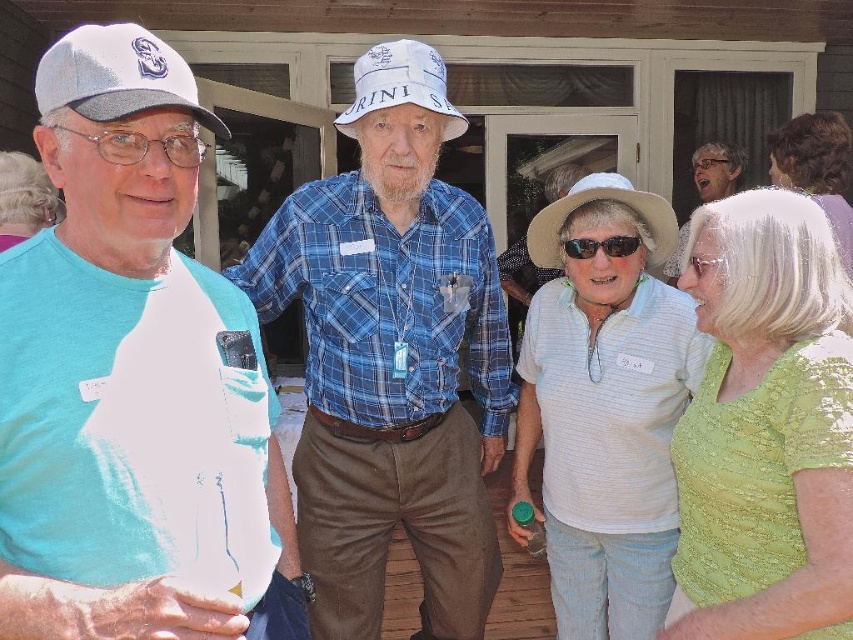
Is matte white cap at left thinner than blue plaid shirt at center?

Yes, matte white cap at left is thinner than blue plaid shirt at center.

Does point (244, 355) come farther from viewer compared to point (387, 115)?

No, it is not.

This screenshot has width=853, height=640. What are the coordinates of `matte white cap at left` in the screenshot? It's located at (120, 372).

This screenshot has width=853, height=640. What do you see at coordinates (766, 426) in the screenshot?
I see `green sequined blouse at right` at bounding box center [766, 426].

Is green sequined blouse at right bigger than white textured shirt at center?

Actually, green sequined blouse at right might be smaller than white textured shirt at center.

This screenshot has height=640, width=853. What do you see at coordinates (766, 426) in the screenshot? I see `green sequined blouse at right` at bounding box center [766, 426].

Identify the location of green sequined blouse at right. (766, 426).

Does matte white cap at left have a lesser width compared to white matte baseball cap at left?

No, matte white cap at left is not thinner than white matte baseball cap at left.

Is matte white cap at left taller than white matte baseball cap at left?

A: Correct, matte white cap at left is much taller as white matte baseball cap at left.

What do you see at coordinates (120, 372) in the screenshot? This screenshot has width=853, height=640. I see `matte white cap at left` at bounding box center [120, 372].

The height and width of the screenshot is (640, 853). In order to click on matte white cap at left in this screenshot , I will do `click(120, 372)`.